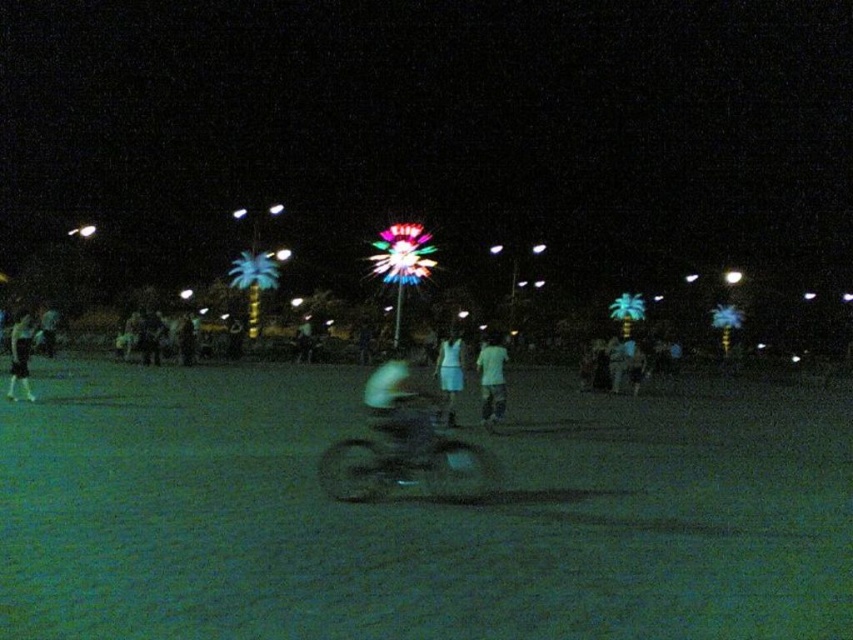
You are a photographer trying to capture a clear shot of the dark matte motorcycle at center and the white matte dress at center in the nighttime scene. Since the motorcycle takes up less space than the dress, which object should you focus on first to ensure both are in frame?

Since the dark matte motorcycle at center occupies less space than the white matte dress at center, you should focus on the white matte dress at center first to ensure it fits within the frame, as it takes up more space.

You are a photographer trying to capture the festive palm trees in the background. To ensure the white matte shirt at center doesn not block your view, where should you position yourself relative to the shirt?

To avoid blocking the view of the festive palm trees in the background, you should position yourself behind the white matte shirt at center so that the shirt is between you and the palm trees.